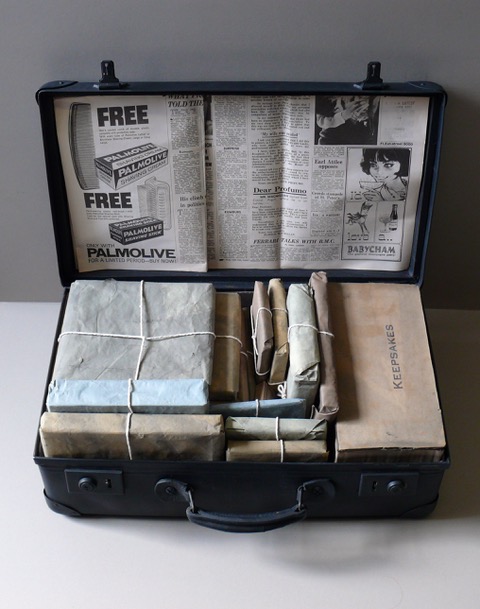
At what (x,y) coordinates should I click in order to perform the action: click on box. Please return your answer as a coordinate pair (x, y). Looking at the image, I should click on (284, 338).